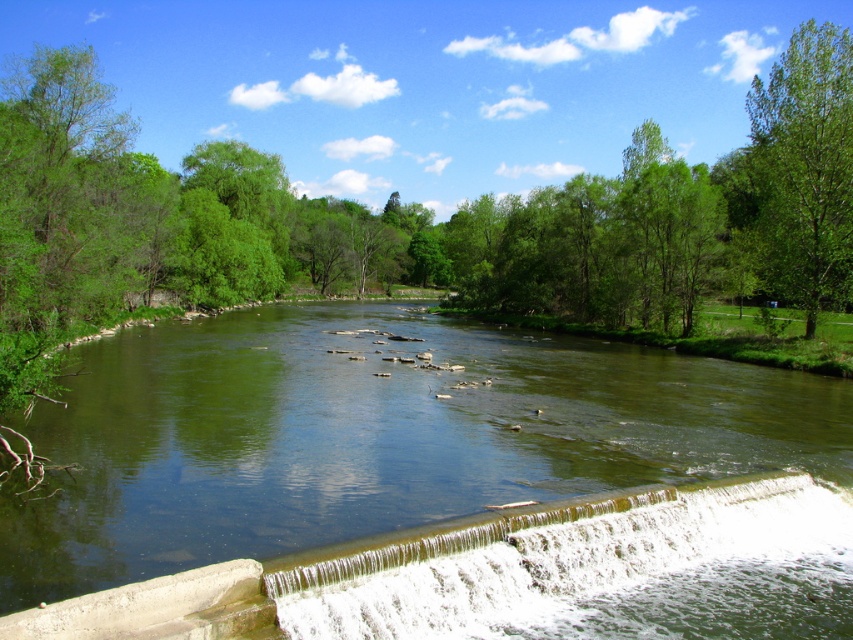
Question: Which of the following is the farthest from the observer?

Choices:
 (A) white frothy water at lower center
 (B) green smooth river at center

Answer: (A)

Question: Does green smooth river at center come behind green leafy tree at upper right?

Choices:
 (A) yes
 (B) no

Answer: (B)

Question: Does green smooth river at center come behind white frothy water at lower center?

Choices:
 (A) no
 (B) yes

Answer: (A)

Question: Which of the following is the farthest from the observer?

Choices:
 (A) (850, 556)
 (B) (358, 496)

Answer: (B)

Question: Observing the image, what is the correct spatial positioning of green smooth river at center in reference to white frothy water at lower center?

Choices:
 (A) above
 (B) below

Answer: (A)

Question: Which object is the closest to the green leafy tree at upper right?

Choices:
 (A) white frothy water at lower center
 (B) green smooth river at center

Answer: (B)